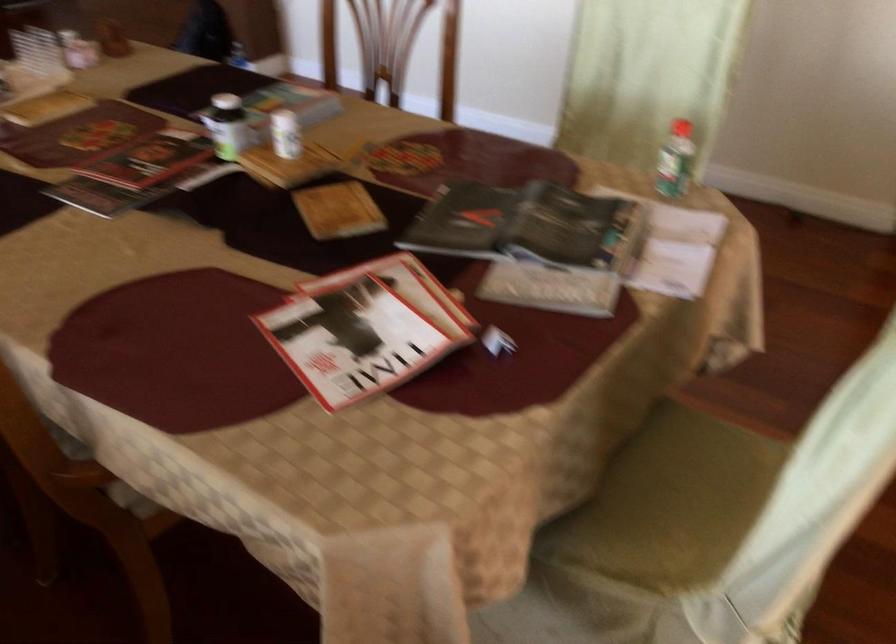
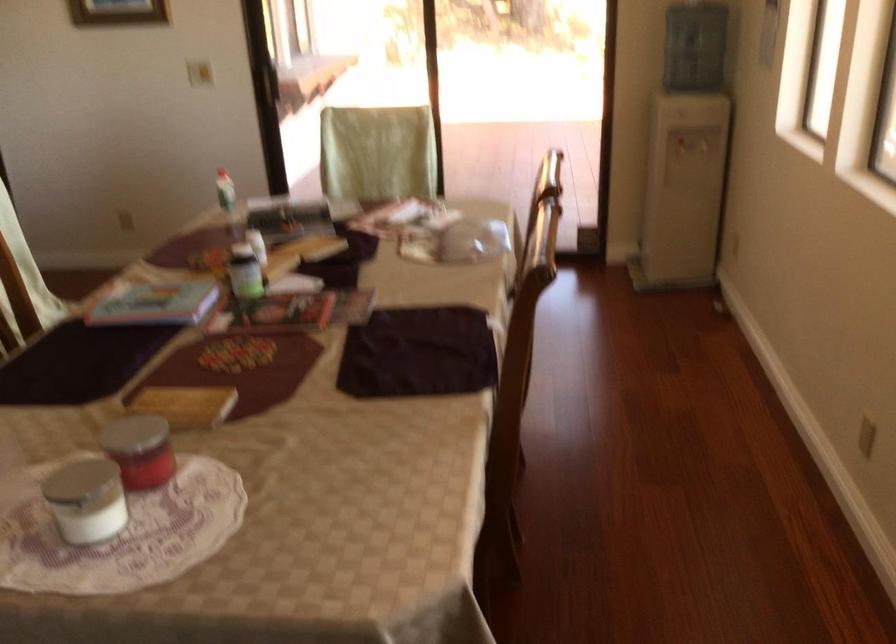
The point at (664, 161) is marked in the first image. Where is the corresponding point in the second image?

(225, 190)